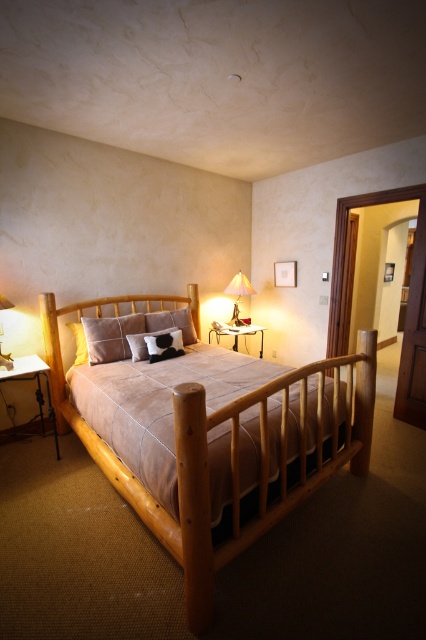
Question: Is brown wooden headboard at center smaller than cow print fabric pillow at center?

Choices:
 (A) no
 (B) yes

Answer: (A)

Question: Is brown leather bed at center above matte gold lamp at upper right?

Choices:
 (A) yes
 (B) no

Answer: (B)

Question: Where is cow print fabric pillow at center located in relation to suede-like pillow at center in the image?

Choices:
 (A) left
 (B) right

Answer: (A)

Question: Which object appears closest to the camera in this image?

Choices:
 (A) brown leather bed at center
 (B) matte gold lamp at upper right
 (C) suede-like pillow at center
 (D) brown wooden headboard at center

Answer: (A)

Question: Among these points, which one is nearest to the camera?

Choices:
 (A) (135, 348)
 (B) (233, 307)
 (C) (104, 330)
 (D) (193, 291)

Answer: (A)

Question: Which is farther from the velvet brown pillow at center?

Choices:
 (A) matte gold lamp at upper right
 (B) brown wooden headboard at center

Answer: (A)